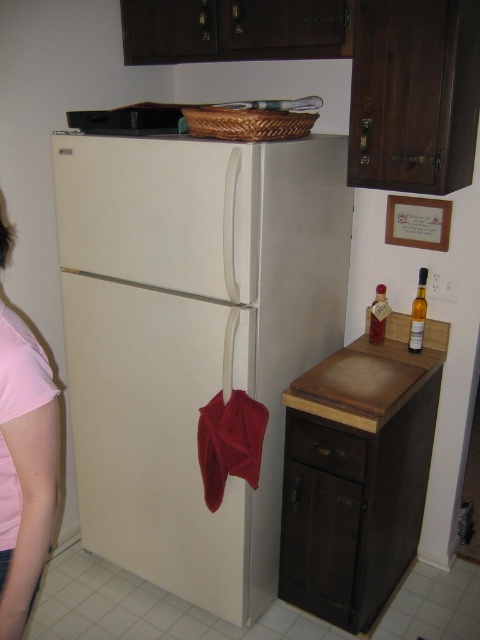
Does white matte refrigerator at center come in front of brown wood drawer at lower center?

That is True.

Which is more to the left, white matte refrigerator at center or brown wood drawer at lower center?

From the viewer's perspective, white matte refrigerator at center appears more on the left side.

Does point (140, 390) lie in front of point (297, 420)?

That is False.

At what (x,y) coordinates should I click in order to perform the action: click on white matte refrigerator at center. Please return your answer as a coordinate pair (x, y). Looking at the image, I should click on (192, 339).

From the picture: Does pink fabric shirt at left appear on the right side of translucent glass bottle at right?

No, pink fabric shirt at left is not to the right of translucent glass bottle at right.

Between point (16, 598) and point (380, 296), which one is positioned behind?

The point (380, 296) is behind.

Is point (52, 454) in front of point (379, 342)?

Yes.

Where is `pink fabric shirt at left`? pink fabric shirt at left is located at coordinates (24, 468).

Is white matte refrigerator at center to the left of translucent glass bottle at right from the viewer's perspective?

Correct, you'll find white matte refrigerator at center to the left of translucent glass bottle at right.

Does white matte refrigerator at center lie in front of translucent glass bottle at right?

Yes, white matte refrigerator at center is closer to the viewer.

Image resolution: width=480 pixels, height=640 pixels. Find the location of `white matte refrigerator at center`. white matte refrigerator at center is located at coordinates (192, 339).

Where is `white matte refrigerator at center`? white matte refrigerator at center is located at coordinates (x=192, y=339).